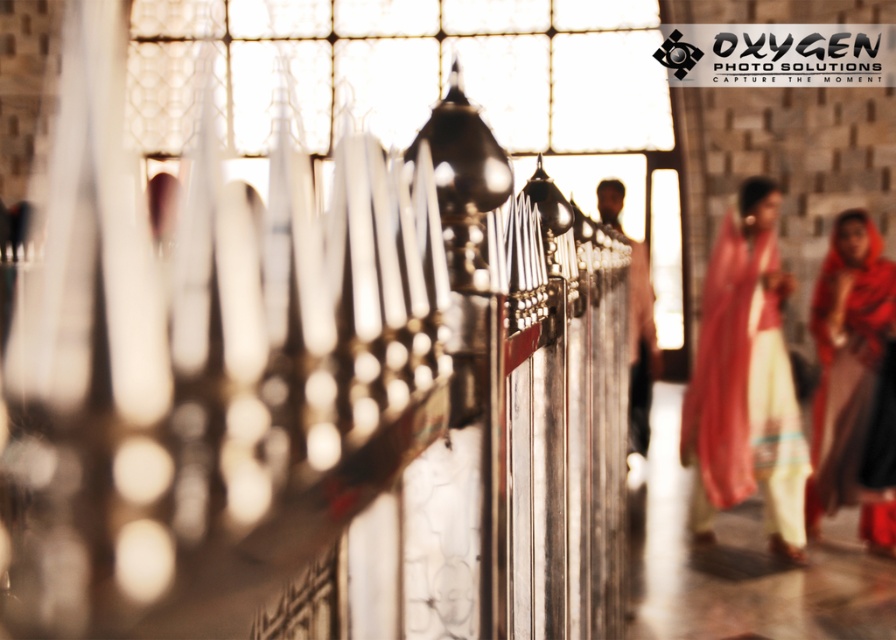
Question: Among these objects, which one is farthest from the camera?

Choices:
 (A) matte pink fabric at right
 (B) matte red fabric at right

Answer: (B)

Question: Estimate the real-world distances between objects in this image. Which object is farther from the matte red fabric at right?

Choices:
 (A) matte brown shirt at center
 (B) matte pink fabric at right

Answer: (A)

Question: Is matte pink fabric at right positioned at the back of matte brown shirt at center?

Choices:
 (A) no
 (B) yes

Answer: (A)

Question: Which point is farther to the camera?

Choices:
 (A) matte brown shirt at center
 (B) matte red fabric at right

Answer: (A)

Question: In this image, where is matte pink fabric at right located relative to matte brown shirt at center?

Choices:
 (A) right
 (B) left

Answer: (A)

Question: Is matte pink fabric at right thinner than matte brown shirt at center?

Choices:
 (A) yes
 (B) no

Answer: (B)